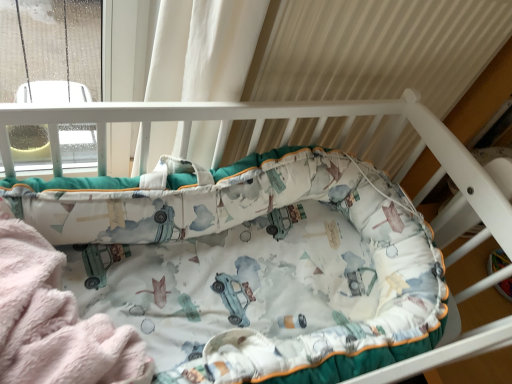
What do you see at coordinates (56, 322) in the screenshot? I see `fluffy pink blanket at lower left` at bounding box center [56, 322].

Find the location of a particular element. fluffy pink blanket at lower left is located at coordinates (56, 322).

Locate an element on the screen. Image resolution: width=512 pixels, height=384 pixels. fluffy pink blanket at lower left is located at coordinates (56, 322).